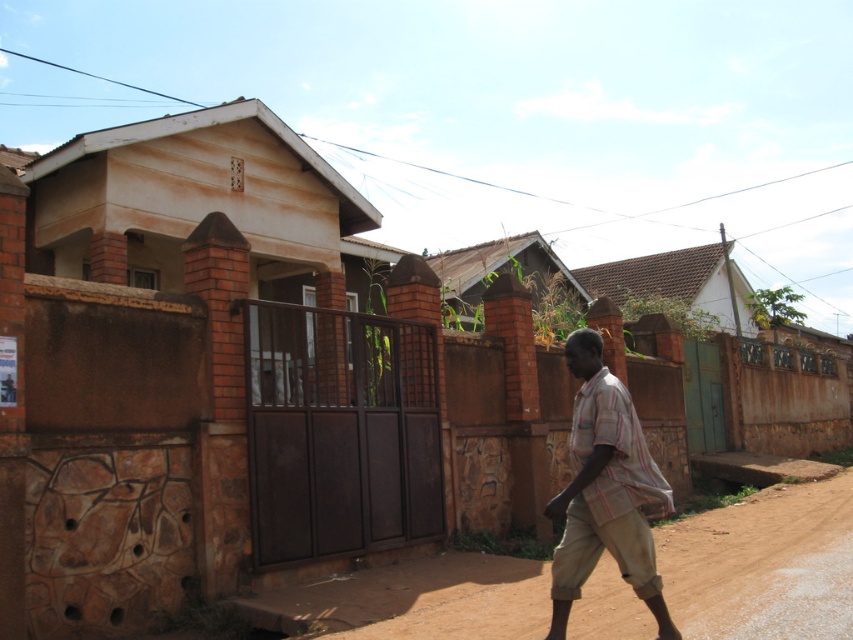
Does brown dirt track at lower right lie in front of striped cotton shirt at center?

No, brown dirt track at lower right is further to the viewer.

Between brown dirt track at lower right and striped cotton shirt at center, which one has less height?

With less height is brown dirt track at lower right.

The height and width of the screenshot is (640, 853). What do you see at coordinates (763, 564) in the screenshot?
I see `brown dirt track at lower right` at bounding box center [763, 564].

The height and width of the screenshot is (640, 853). I want to click on brown dirt track at lower right, so click(763, 564).

Is point (311, 468) behind point (759, 577)?

Yes.

Does brown metal gate at center have a greater height compared to brown dirt track at lower right?

Correct, brown metal gate at center is much taller as brown dirt track at lower right.

Image resolution: width=853 pixels, height=640 pixels. Describe the element at coordinates (340, 433) in the screenshot. I see `brown metal gate at center` at that location.

The width and height of the screenshot is (853, 640). I want to click on brown metal gate at center, so click(x=340, y=433).

Is brown metal gate at center above striped cotton shirt at center?

Correct, brown metal gate at center is located above striped cotton shirt at center.

In the scene shown: Can you confirm if brown metal gate at center is bigger than striped cotton shirt at center?

Indeed, brown metal gate at center has a larger size compared to striped cotton shirt at center.

Does point (433, 506) come farther from viewer compared to point (637, 433)?

That is True.

This screenshot has width=853, height=640. In order to click on brown metal gate at center in this screenshot , I will do `click(340, 433)`.